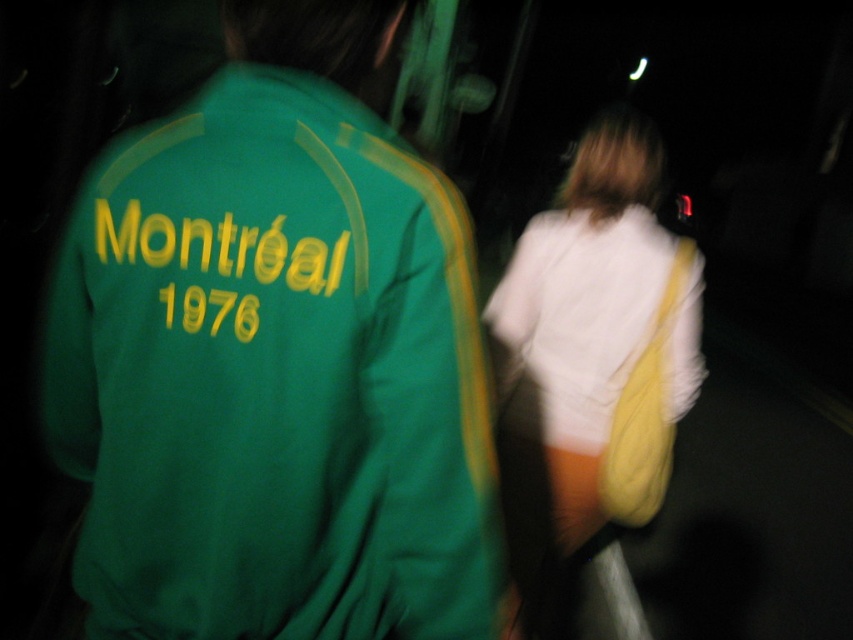
Question: Among these objects, which one is nearest to the camera?

Choices:
 (A) white soft sweatshirt at right
 (B) white fabric bag at upper right

Answer: (B)

Question: Does green fabric jacket at left have a smaller size compared to white soft sweatshirt at right?

Choices:
 (A) no
 (B) yes

Answer: (B)

Question: Does white fabric bag at upper right appear over white soft sweatshirt at right?

Choices:
 (A) yes
 (B) no

Answer: (A)

Question: Which object appears farthest from the camera in this image?

Choices:
 (A) white fabric bag at upper right
 (B) green fabric jacket at left
 (C) white soft sweatshirt at right

Answer: (C)

Question: Can you confirm if green fabric jacket at left is thinner than white soft sweatshirt at right?

Choices:
 (A) no
 (B) yes

Answer: (A)

Question: Which point appears closest to the camera in this image?

Choices:
 (A) (416, 193)
 (B) (546, 509)

Answer: (A)